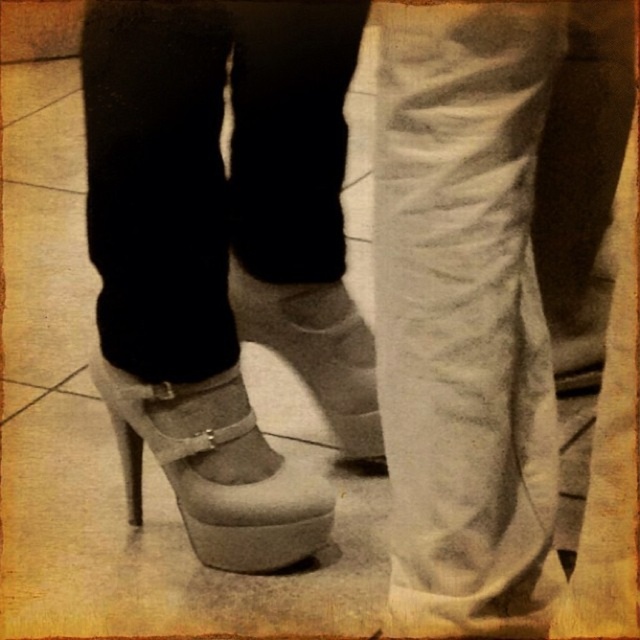
Does matte gray sandal at center have a greater width compared to white suede shoe at center?

Indeed, matte gray sandal at center has a greater width compared to white suede shoe at center.

Between matte gray sandal at center and white suede shoe at center, which one appears on the left side from the viewer's perspective?

matte gray sandal at center

Is point (289, 552) in front of point (268, 348)?

Yes, point (289, 552) is closer to viewer.

Where is `matte gray sandal at center`? This screenshot has width=640, height=640. matte gray sandal at center is located at coordinates (216, 470).